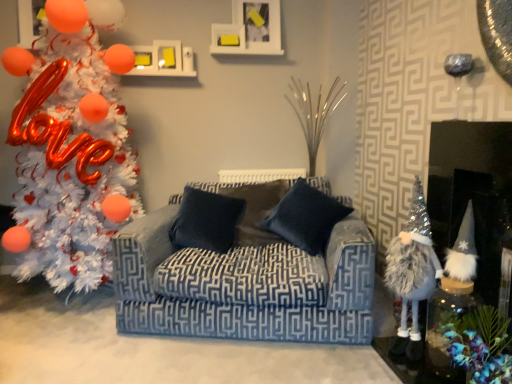
Question: Is fuzzy silver gnome at right, which appears as the 1th toy when viewed from the right, at the left side of fuzzy silver gnome at right, which ranks as the second toy in right-to-left order?

Choices:
 (A) no
 (B) yes

Answer: (A)

Question: Is fuzzy silver gnome at right, which appears as the 1th toy when viewed from the right, positioned with its back to fuzzy silver gnome at right, which ranks as the second toy in right-to-left order?

Choices:
 (A) no
 (B) yes

Answer: (A)

Question: Is fuzzy silver gnome at right, which is the 2th toy in left-to-right order, to the right of fuzzy silver gnome at right, which ranks as the second toy in right-to-left order, from the viewer's perspective?

Choices:
 (A) no
 (B) yes

Answer: (B)

Question: Considering the relative sizes of fuzzy silver gnome at right, which is the 2th toy in left-to-right order, and fuzzy silver gnome at right, which is the first toy in left-to-right order, in the image provided, is fuzzy silver gnome at right, which is the 2th toy in left-to-right order, wider than fuzzy silver gnome at right, which is the first toy in left-to-right order,?

Choices:
 (A) no
 (B) yes

Answer: (B)

Question: Can you confirm if fuzzy silver gnome at right, which appears as the 1th toy when viewed from the right, is taller than fuzzy silver gnome at right, which ranks as the second toy in right-to-left order?

Choices:
 (A) yes
 (B) no

Answer: (B)

Question: Is fuzzy silver gnome at right, which is the 2th toy in left-to-right order, behind fuzzy silver gnome at right, which ranks as the second toy in right-to-left order?

Choices:
 (A) yes
 (B) no

Answer: (B)

Question: From a real-world perspective, is dark blue fabric pillow at center, positioned as the 2th pillow in left-to-right order, under white tinsel christmas tree at left?

Choices:
 (A) no
 (B) yes

Answer: (B)

Question: From the image's perspective, is dark blue fabric pillow at center, which appears as the 1th pillow when viewed from the right, on top of white tinsel christmas tree at left?

Choices:
 (A) yes
 (B) no

Answer: (B)

Question: Is dark blue fabric pillow at center, which appears as the 1th pillow when viewed from the right, to the left of white tinsel christmas tree at left from the viewer's perspective?

Choices:
 (A) no
 (B) yes

Answer: (A)

Question: Is dark blue fabric pillow at center, positioned as the 2th pillow in left-to-right order, with white tinsel christmas tree at left?

Choices:
 (A) no
 (B) yes

Answer: (A)

Question: Is dark blue fabric pillow at center, which appears as the 1th pillow when viewed from the right, looking in the opposite direction of white tinsel christmas tree at left?

Choices:
 (A) no
 (B) yes

Answer: (A)

Question: Can white tinsel christmas tree at left be found inside dark blue fabric pillow at center, which appears as the 1th pillow when viewed from the right?

Choices:
 (A) no
 (B) yes

Answer: (A)

Question: Can you confirm if dark blue fabric pillow at center, which appears as the 1th pillow when viewed from the right, is positioned to the left of dark blue fabric pillow at center, marked as the first pillow in a left-to-right arrangement?

Choices:
 (A) yes
 (B) no

Answer: (B)